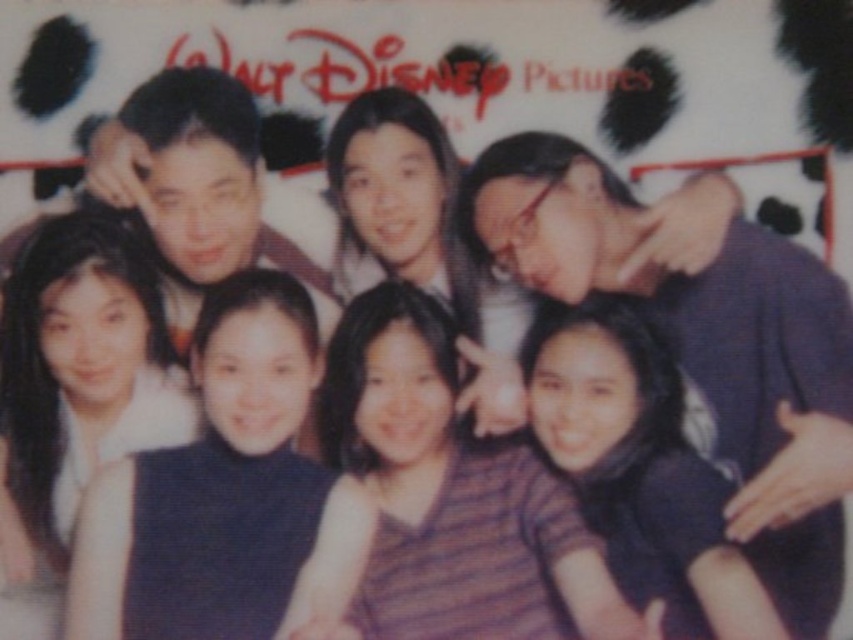
In the scene shown: You are a photographer trying to adjust the height of two dresses in a group photo. The smooth black dress at lower left and the dark blue dress at center are partially overlapping. Which dress should you move upwards to avoid covering the other?

The smooth black dress at lower left is taller than the dark blue dress at center, so you should move the dark blue dress at center upwards to avoid covering the other.

You are a photographer setting up for a group photo. You notice two shirts in the center of the group. The striped fabric shirt at center and the matte purple shirt at center. Which one is positioned lower in the frame?

The striped fabric shirt at center is positioned lower because it is below the matte purple shirt at center.

You are a photographer holding a camera and standing 1.49 meters away from the smooth black dress at lower left. Can you comfortably take a photo of the dress without moving closer?

Yes, the camera is 1.49 meters away from the smooth black dress at lower left, so you can comfortably take a photo without moving closer.